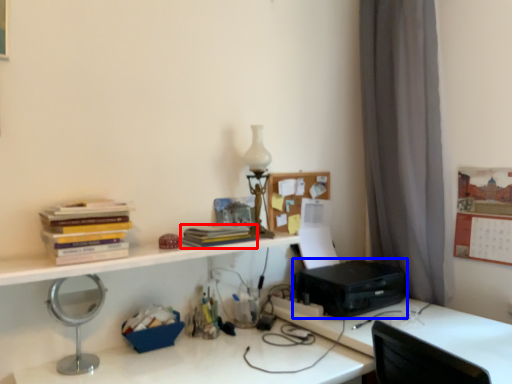
Question: Which point is further to the camera, paperback book (highlighted by a red box) or printer (highlighted by a blue box)?

Choices:
 (A) paperback book
 (B) printer

Answer: (B)